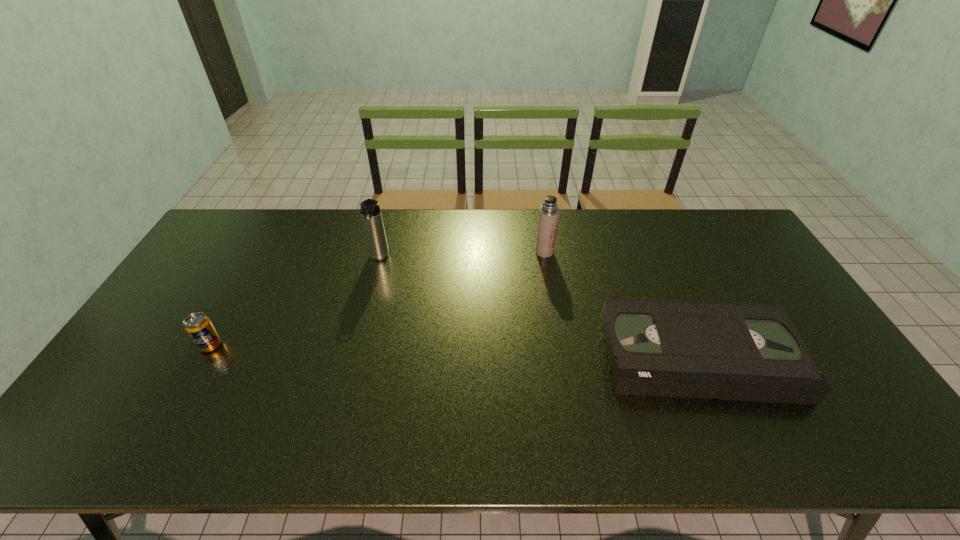
Where is `vacant space that's between the right thermos bottle and the leftmost object`? vacant space that's between the right thermos bottle and the leftmost object is located at coordinates (377, 299).

Where is `vacant space in between the shortest object and the third tallest object`? This screenshot has height=540, width=960. vacant space in between the shortest object and the third tallest object is located at coordinates (454, 350).

The image size is (960, 540). In order to click on blank region between the right thermos bottle and the second object from left to right in this screenshot , I will do `click(462, 255)`.

Locate an element on the screen. object that is the second closest to the third tallest object is located at coordinates (548, 217).

Locate which object ranks in proximity to the right thermos bottle. Please provide its 2D coordinates. Your answer should be formatted as a tuple, i.e. [(x, y)], where the tuple contains the x and y coordinates of a point satisfying the conditions above.

[(688, 349)]

Where is `free location that satisfies the following two spatial constraints: 1. on the handle side of the third object from right to left; 2. on the left side of the shortest object`? free location that satisfies the following two spatial constraints: 1. on the handle side of the third object from right to left; 2. on the left side of the shortest object is located at coordinates (354, 355).

Find the location of a particular element. The image size is (960, 540). free spot that satisfies the following two spatial constraints: 1. on the front side of the second shortest object; 2. on the right side of the rightmost object is located at coordinates (204, 355).

At what (x,y) coordinates should I click in order to perform the action: click on vacant position in the image that satisfies the following two spatial constraints: 1. on the front side of the third object from left to right; 2. on the left side of the shortest object. Please return your answer as a coordinate pair (x, y). Looking at the image, I should click on click(x=562, y=355).